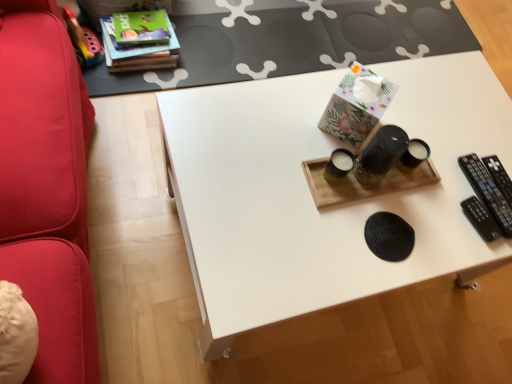
Question: Considering the relative sizes of hardcover book at upper left and black plastic remote at right in the image provided, is hardcover book at upper left bigger than black plastic remote at right?

Choices:
 (A) no
 (B) yes

Answer: (B)

Question: Is hardcover book at upper left taller than black plastic remote at right?

Choices:
 (A) no
 (B) yes

Answer: (B)

Question: Does hardcover book at upper left have a lesser width compared to black plastic remote at right?

Choices:
 (A) no
 (B) yes

Answer: (A)

Question: Is black plastic remote at right inside hardcover book at upper left?

Choices:
 (A) no
 (B) yes

Answer: (A)

Question: From the image's perspective, would you say hardcover book at upper left is positioned over black plastic remote at right?

Choices:
 (A) no
 (B) yes

Answer: (B)

Question: Choose the correct answer: Is white matte table at upper center inside hardcover book at upper left or outside it?

Choices:
 (A) inside
 (B) outside

Answer: (B)

Question: Considering the positions of white matte table at upper center and hardcover book at upper left in the image, is white matte table at upper center wider or thinner than hardcover book at upper left?

Choices:
 (A) thin
 (B) wide

Answer: (B)

Question: From the image's perspective, relative to hardcover book at upper left, is white matte table at upper center above or below?

Choices:
 (A) above
 (B) below

Answer: (A)

Question: Is white matte table at upper center taller or shorter than hardcover book at upper left?

Choices:
 (A) short
 (B) tall

Answer: (A)

Question: Visually, is white matte tray at center positioned to the left or to the right of hardcover book at upper left?

Choices:
 (A) left
 (B) right

Answer: (B)

Question: Is point (243, 246) closer or farther from the camera than point (113, 36)?

Choices:
 (A) closer
 (B) farther

Answer: (A)

Question: Relative to hardcover book at upper left, is white matte tray at center in front or behind?

Choices:
 (A) front
 (B) behind

Answer: (A)

Question: From a real-world perspective, is white matte tray at center above or below hardcover book at upper left?

Choices:
 (A) below
 (B) above

Answer: (B)

Question: From the image's perspective, is white matte tray at center above or below black plastic remote at right?

Choices:
 (A) above
 (B) below

Answer: (B)

Question: Does point (497, 122) appear closer or farther from the camera than point (482, 163)?

Choices:
 (A) closer
 (B) farther

Answer: (B)